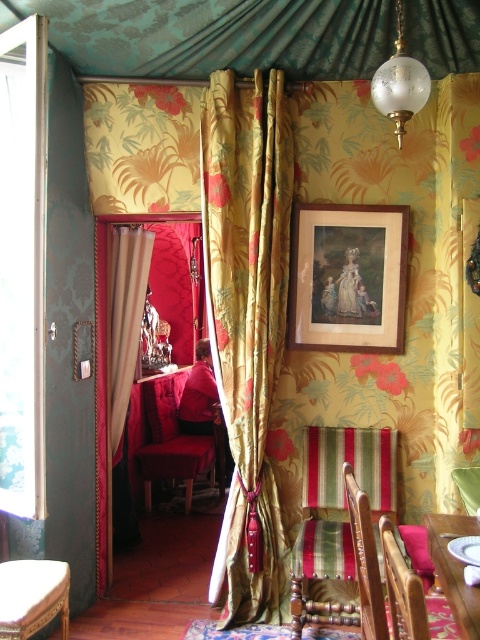
You are planning to hang a large painting that requires a minimum of 2 meters in width. Given the teal damask fabric canopy at upper center and the striped fabric armchair at lower right in the room, which object provides enough space for the painting?

The teal damask fabric canopy at upper center is bigger than the striped fabric armchair at lower right, so the teal damask fabric canopy at upper center can accommodate the painting requiring 2 meters in width.

You are a delivery person carrying a package that is 3 feet long. You need to move through the space between the beige fabric curtain at left and the wooden cushioned stool at lower left. Can you pass through this space without bending or tilting the package?

The beige fabric curtain at left and wooden cushioned stool at lower left are 3.64 feet apart. Since the package is 3 feet long, which is shorter than the 3.64 feet gap, you can pass through the space without bending or tilting the package.